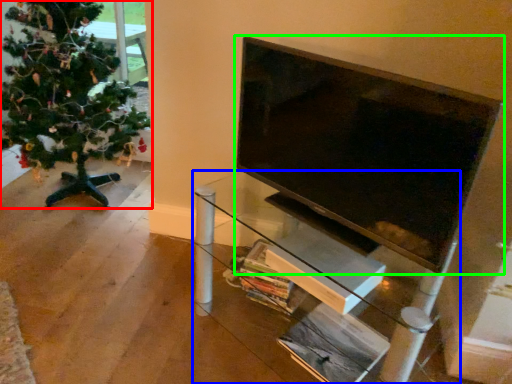
Question: Which object is positioned farthest from christmas tree (highlighted by a red box)? Select from furniture (highlighted by a blue box) and television (highlighted by a green box).

Choices:
 (A) furniture
 (B) television

Answer: (B)